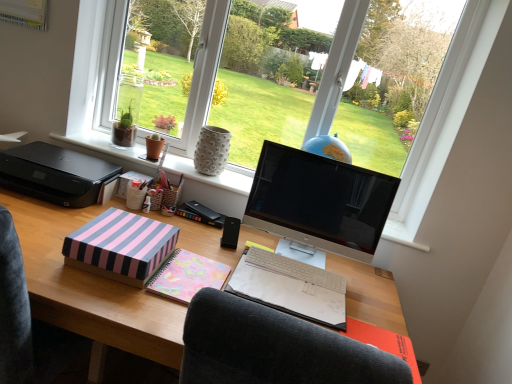
Find the location of a particular element. This screenshot has width=512, height=384. vacant space behind pastel pink paper at lower right is located at coordinates (374, 309).